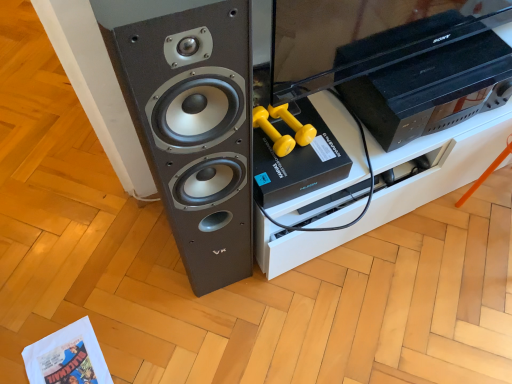
Question: Considering the positions of point (181, 81) and point (453, 79), is point (181, 81) closer or farther from the camera than point (453, 79)?

Choices:
 (A) farther
 (B) closer

Answer: (B)

Question: Is matte black speaker at left to the left or to the right of black plastic sony tv at upper right in the image?

Choices:
 (A) right
 (B) left

Answer: (B)

Question: Which object is positioned closest to the matte black speaker at left?

Choices:
 (A) black plastic sony tv at upper right
 (B) black plastic tv stand at center

Answer: (B)

Question: Which is farther from the black plastic tv stand at center?

Choices:
 (A) matte black speaker at left
 (B) black plastic sony tv at upper right

Answer: (A)